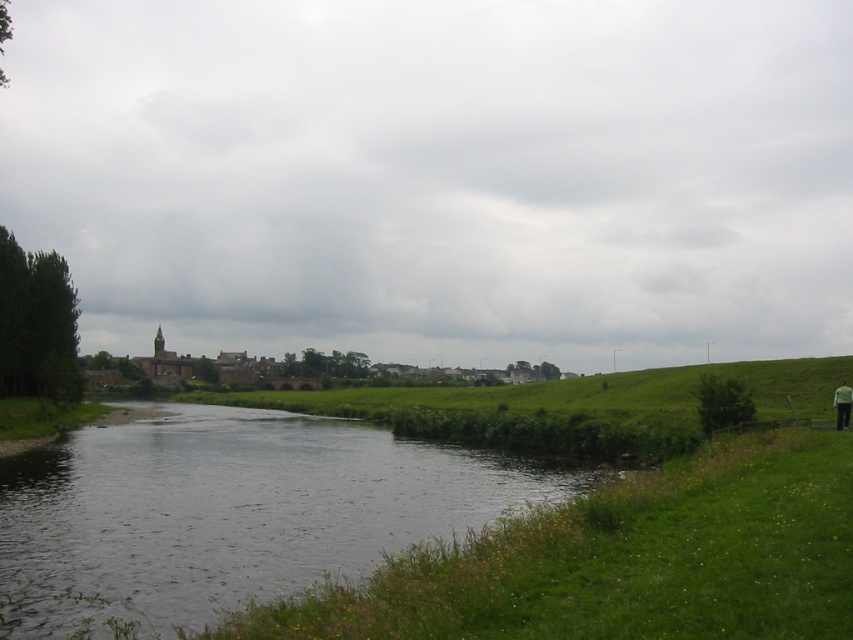
You are standing at the edge of the riverbank in the rural landscape. You need to walk from the green grassy at lower right to the green fabric person at lower right. How far will you have to walk?

The distance between the green grassy at lower right and the green fabric person at lower right is 16.54 meters, so you will have to walk 16.54 meters.

You are standing at the edge of the river in the rural landscape and notice both the green grassy at lower right and the green fabric person at lower right. Which of these two is taller?

The green grassy at lower right is much taller than the green fabric person at lower right.